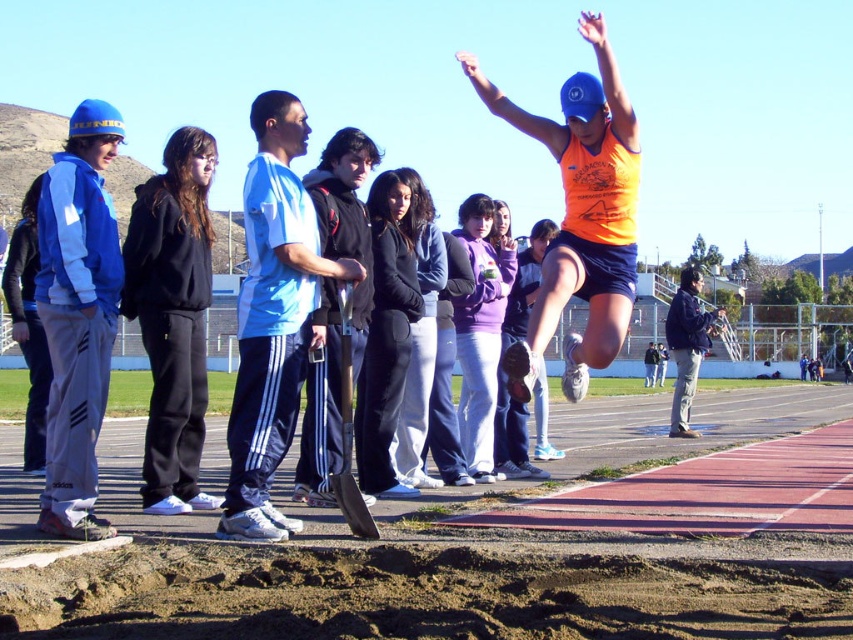
Question: Observing the image, what is the correct spatial positioning of black fabric jacket at center in reference to blue denim jacket at upper center?

Choices:
 (A) above
 (B) below

Answer: (B)

Question: Among these points, which one is farthest from the camera?

Choices:
 (A) (331, 300)
 (B) (86, 557)

Answer: (A)

Question: Which of these objects is positioned farthest from the black fabric jacket at center?

Choices:
 (A) brown sandy dirt track at lower center
 (B) blue denim jacket at upper center
 (C) blue athletic wear at center

Answer: (B)

Question: Can you confirm if brown sandy dirt track at lower center is positioned to the left of blue athletic wear at center?

Choices:
 (A) yes
 (B) no

Answer: (B)

Question: Observing the image, what is the correct spatial positioning of brown sandy dirt track at lower center in reference to black fabric jacket at center?

Choices:
 (A) above
 (B) below

Answer: (B)

Question: Which object is the closest to the brown sandy dirt track at lower center?

Choices:
 (A) blue athletic wear at center
 (B) blue denim jacket at upper center

Answer: (A)